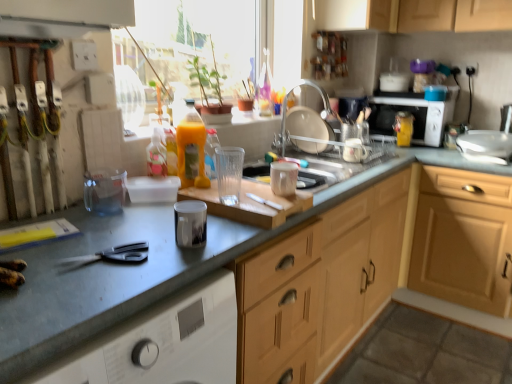
Find the location of a particular element. free area in between shiny metallic cup at center, the first appliance in the front-to-back sequence, and black plastic scissors at lower left is located at coordinates (152, 249).